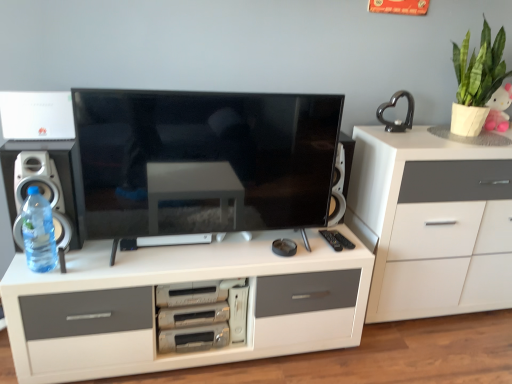
Question: Can you confirm if white matte cabinet at right, positioned as the second chest of drawers in bottom-to-top order, is wider than pink plush toy at upper right?

Choices:
 (A) no
 (B) yes

Answer: (B)

Question: Is white matte cabinet at right, positioned as the second chest of drawers in bottom-to-top order, thinner than pink plush toy at upper right?

Choices:
 (A) no
 (B) yes

Answer: (A)

Question: Does white matte cabinet at right, positioned as the second chest of drawers in bottom-to-top order, have a larger size compared to pink plush toy at upper right?

Choices:
 (A) no
 (B) yes

Answer: (B)

Question: Would you consider white matte cabinet at right, positioned as the second chest of drawers in bottom-to-top order, to be distant from pink plush toy at upper right?

Choices:
 (A) no
 (B) yes

Answer: (A)

Question: Is white matte cabinet at right, positioned as the 1th chest of drawers in top-to-bottom order, positioned behind pink plush toy at upper right?

Choices:
 (A) yes
 (B) no

Answer: (B)

Question: Considering the relative positions of white matte cabinet at right, positioned as the 1th chest of drawers in top-to-bottom order, and pink plush toy at upper right in the image provided, is white matte cabinet at right, positioned as the 1th chest of drawers in top-to-bottom order, to the right of pink plush toy at upper right from the viewer's perspective?

Choices:
 (A) no
 (B) yes

Answer: (A)

Question: From the image's perspective, does green leafy plant in white pot at upper right appear lower than white matte chest of drawers at center, which is the 1th chest of drawers from bottom to top?

Choices:
 (A) no
 (B) yes

Answer: (A)

Question: Would you say green leafy plant in white pot at upper right is outside white matte chest of drawers at center, which is the 1th chest of drawers from bottom to top?

Choices:
 (A) no
 (B) yes

Answer: (B)

Question: Considering the relative sizes of green leafy plant in white pot at upper right and white matte chest of drawers at center, arranged as the 2th chest of drawers when viewed from the top, in the image provided, is green leafy plant in white pot at upper right bigger than white matte chest of drawers at center, arranged as the 2th chest of drawers when viewed from the top,?

Choices:
 (A) yes
 (B) no

Answer: (B)

Question: Is green leafy plant in white pot at upper right further to camera compared to white matte chest of drawers at center, which is the 1th chest of drawers from bottom to top?

Choices:
 (A) yes
 (B) no

Answer: (A)

Question: Is green leafy plant in white pot at upper right beside white matte chest of drawers at center, arranged as the 2th chest of drawers when viewed from the top?

Choices:
 (A) no
 (B) yes

Answer: (A)

Question: Can you confirm if green leafy plant in white pot at upper right is wider than white matte chest of drawers at center, which is the 1th chest of drawers from bottom to top?

Choices:
 (A) yes
 (B) no

Answer: (B)

Question: From a real-world perspective, is white plastic speaker at left physically below pink plush toy at upper right?

Choices:
 (A) yes
 (B) no

Answer: (A)